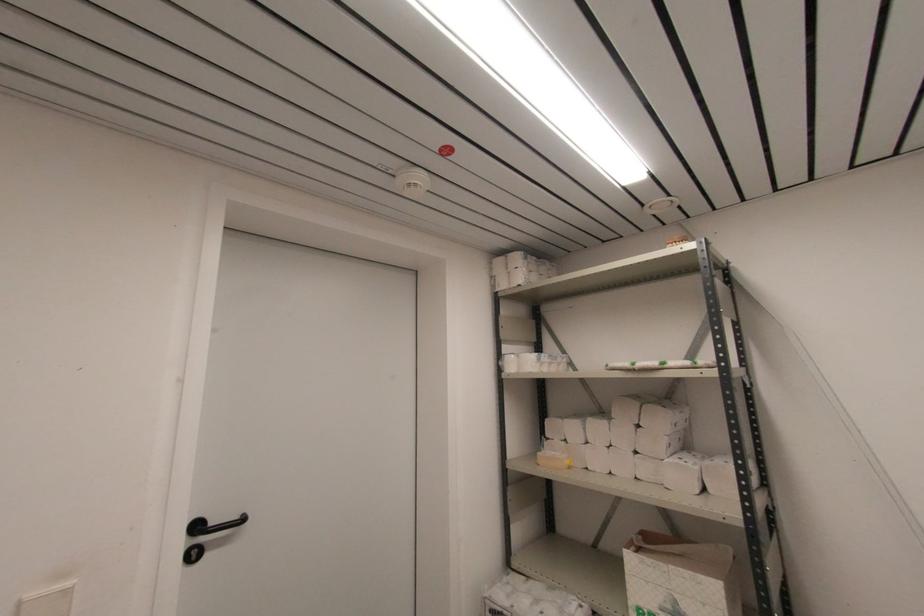
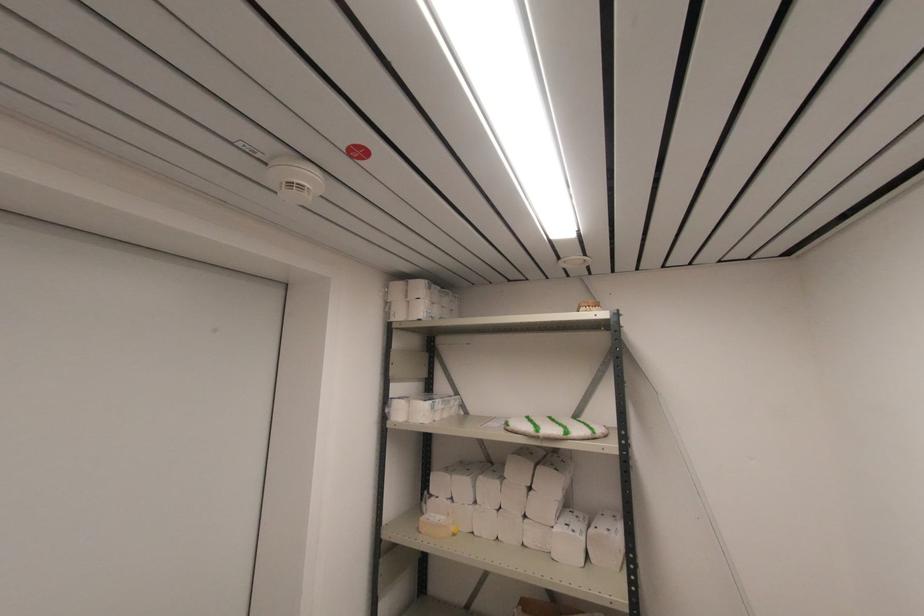
Where in the second image is the point corresponding to [676,243] from the first image?

(590, 307)